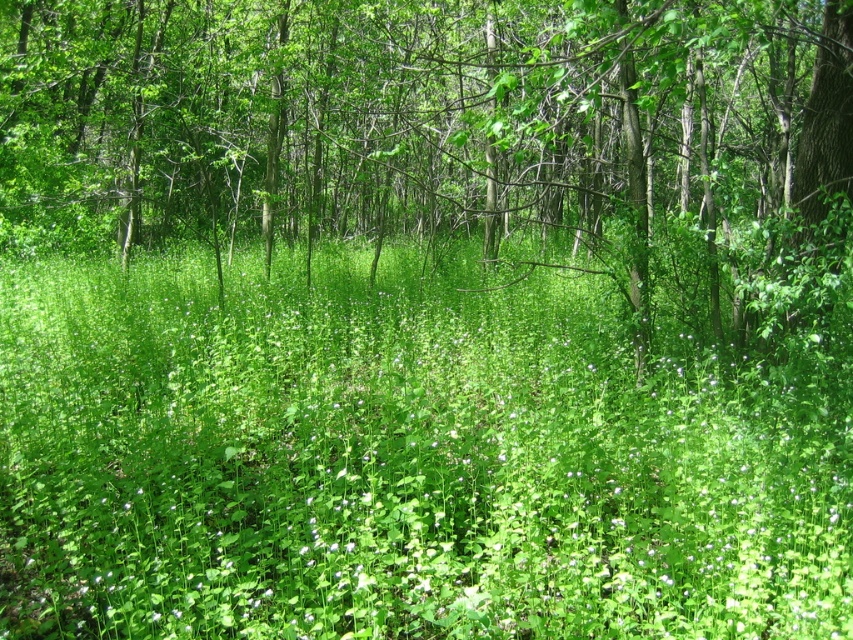
Question: From the image, what is the correct spatial relationship of green leafy grass at center in relation to green leafy tree at center?

Choices:
 (A) above
 (B) below

Answer: (B)

Question: Does green leafy grass at center have a greater width compared to green leafy tree at center?

Choices:
 (A) yes
 (B) no

Answer: (B)

Question: Which point is farther to the camera?

Choices:
 (A) (477, 209)
 (B) (453, 332)

Answer: (A)

Question: Can you confirm if green leafy grass at center is wider than green leafy tree at center?

Choices:
 (A) yes
 (B) no

Answer: (B)